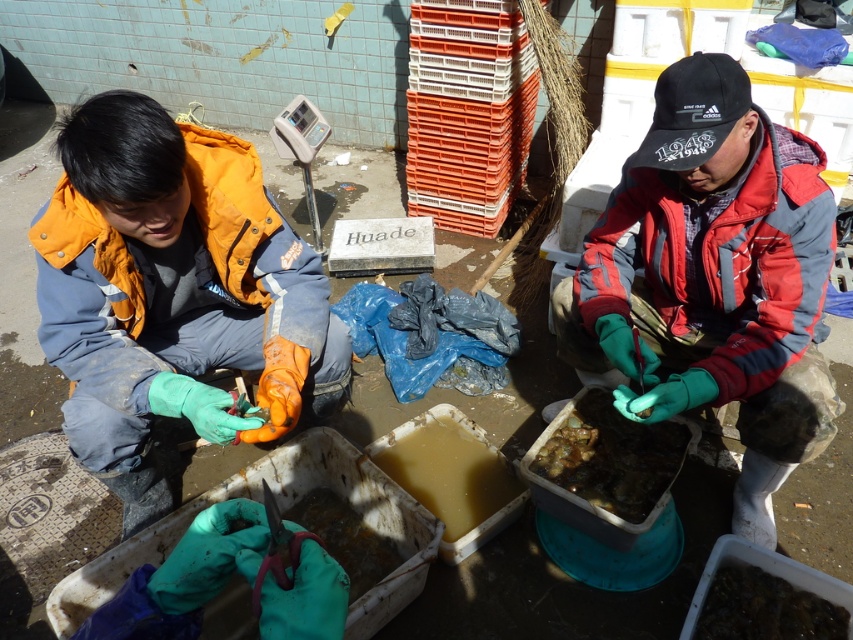
Question: Considering the real-world distances, which object is closest to the brown translucent liquid at center?

Choices:
 (A) orange matte jacket at left
 (B) dark brown rubbery food at lower right
 (C) brown rubbery food at center

Answer: (C)

Question: Which object is closer to the camera taking this photo?

Choices:
 (A) brown translucent liquid at center
 (B) brown rubber food at lower center
 (C) red and gray jacket at center
 (D) orange matte jacket at left

Answer: (D)

Question: Among these points, which one is nearest to the camera?

Choices:
 (A) pos(802,355)
 (B) pos(347,536)
 (C) pos(726,605)

Answer: (A)

Question: Is brown rubbery food at center positioned before dark brown rubbery food at lower right?

Choices:
 (A) no
 (B) yes

Answer: (A)

Question: Can you confirm if red and gray jacket at center is wider than brown rubbery food at center?

Choices:
 (A) yes
 (B) no

Answer: (A)

Question: Is orange matte jacket at left positioned before red and gray jacket at center?

Choices:
 (A) no
 (B) yes

Answer: (B)